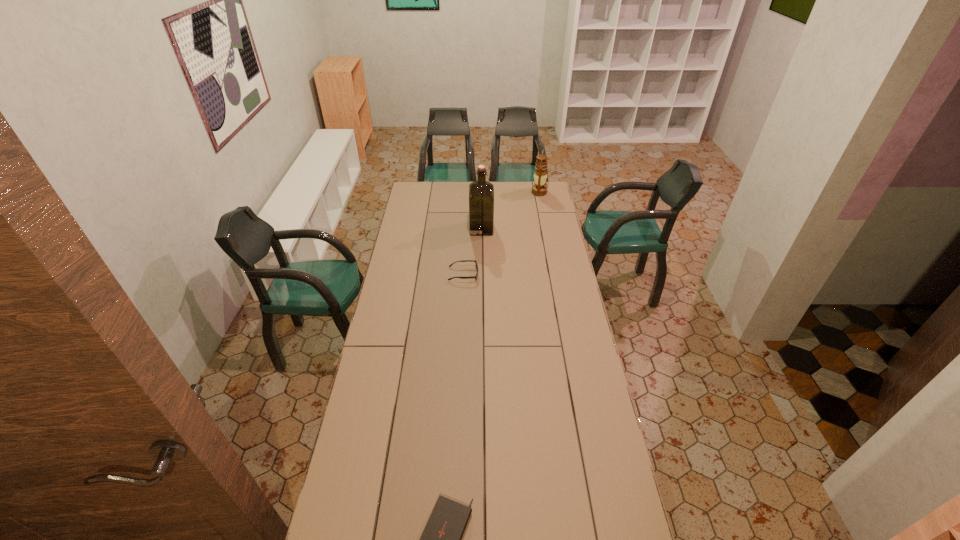
The height and width of the screenshot is (540, 960). In order to click on the third nearest object in this screenshot , I will do `click(481, 192)`.

Where is `the tallest object`? the tallest object is located at coordinates (481, 192).

Image resolution: width=960 pixels, height=540 pixels. Identify the location of the rightmost object. (540, 176).

This screenshot has height=540, width=960. In order to click on the second tallest object in this screenshot , I will do click(x=540, y=176).

Find the location of `the second shortest object`. the second shortest object is located at coordinates (475, 261).

Image resolution: width=960 pixels, height=540 pixels. In order to click on sunglasses in this screenshot , I will do coord(475,261).

The height and width of the screenshot is (540, 960). I want to click on vacant space situated on the label of the tallest object, so 442,228.

Identify the location of free point located on the label of the tallest object. This screenshot has height=540, width=960. (420, 228).

Find the location of a particular element. The image size is (960, 540). blank space located on the label of the tallest object is located at coordinates (427, 228).

The height and width of the screenshot is (540, 960). What are the coordinates of `free space located 0.110m on the front of the rightmost object` in the screenshot? It's located at (542, 208).